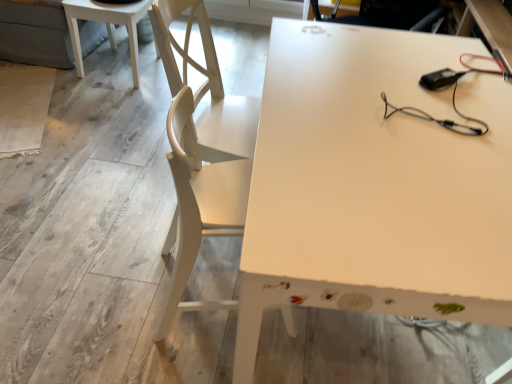
You are a GUI agent. You are given a task and a screenshot of the screen. Output one action in this format:
    pyautogui.click(x=<x>, y=<y>)
    Task: Click on the white wood chair at left
    
    Given the screenshot: What is the action you would take?
    pyautogui.click(x=199, y=204)

You are a GUI agent. You are given a task and a screenshot of the screen. Output one action in this format:
    pyautogui.click(x=<x>, y=<y>)
    Task: Click on the white glossy table at upper left, the first table in the top-to-bottom sequence
    This screenshot has height=384, width=512.
    Given the screenshot: What is the action you would take?
    pyautogui.click(x=106, y=26)

You are a GUI agent. You are given a task and a screenshot of the screen. Output one action in this format:
    pyautogui.click(x=<x>, y=<y>)
    Task: Click on the table above the white glossy table at upper left, acting as the first table starting from the back (from a real-world perspective)
    This screenshot has height=384, width=512.
    Given the screenshot: What is the action you would take?
    pyautogui.click(x=374, y=184)

Which is behind, point (94, 18) or point (377, 299)?

The point (94, 18) is farther.

From the image's perspective, is white glossy table at upper left, the 2th table in the right-to-left sequence, under white matte table at center, the 1th table positioned from the front?

No.

Is the surface of white matte table at center, the 1th table viewed from the right, in direct contact with white glossy table at upper left, the second table in the bottom-to-top sequence?

No, white matte table at center, the 1th table viewed from the right, is not making contact with white glossy table at upper left, the second table in the bottom-to-top sequence.

Is white glossy table at upper left, acting as the first table starting from the back, surrounded by white matte table at center, the 1th table viewed from the right?

No, white glossy table at upper left, acting as the first table starting from the back, is not inside white matte table at center, the 1th table viewed from the right.

Considering the points (504, 101) and (80, 76), which point is behind, point (504, 101) or point (80, 76)?

The point (80, 76) is behind.

Is white matte table at center, arranged as the 2th table when viewed from the top, looking in the opposite direction of white glossy table at upper left, placed as the second table when sorted from front to back?

That's not correct — white matte table at center, arranged as the 2th table when viewed from the top, is not looking away from white glossy table at upper left, placed as the second table when sorted from front to back.

Considering the relative sizes of white wood chair at left and white glossy table at upper left, the first table in the top-to-bottom sequence, in the image provided, is white wood chair at left shorter than white glossy table at upper left, the first table in the top-to-bottom sequence,?

No.

Considering the sizes of objects white wood chair at left and white glossy table at upper left, the first table in the top-to-bottom sequence, in the image provided, who is wider, white wood chair at left or white glossy table at upper left, the first table in the top-to-bottom sequence,?

white glossy table at upper left, the first table in the top-to-bottom sequence.

Does white wood chair at left contain white glossy table at upper left, the 2th table in the right-to-left sequence?

Actually, white glossy table at upper left, the 2th table in the right-to-left sequence, is outside white wood chair at left.

Would you say white wood chair at left is a long distance from white glossy table at upper left, the second table in the bottom-to-top sequence?

white wood chair at left is far away from white glossy table at upper left, the second table in the bottom-to-top sequence.

From the image's perspective, which one is positioned lower, white wood chair at left or white matte table at center, the 1th table viewed from the right?

white wood chair at left.

From a real-world perspective, is white wood chair at left physically above white matte table at center, the 1th table viewed from the right?

Yes.

Is white wood chair at left situated inside white matte table at center, the 1th table ordered from the bottom, or outside?

white wood chair at left is located inside white matte table at center, the 1th table ordered from the bottom.

How many degrees apart are the facing directions of white wood chair at left and white matte table at center, the 1th table positioned from the front?

172 degrees.

Considering the relative sizes of white glossy table at upper left, the first table in the top-to-bottom sequence, and white wood chair at left in the image provided, is white glossy table at upper left, the first table in the top-to-bottom sequence, thinner than white wood chair at left?

No.

Based on their positions, is white glossy table at upper left, placed as the second table when sorted from front to back, located to the left or right of white wood chair at left?

Clearly, white glossy table at upper left, placed as the second table when sorted from front to back, is on the left of white wood chair at left in the image.

Is white glossy table at upper left, acting as the first table starting from the back, positioned in front of white wood chair at left?

That is False.

Considering the relative sizes of white matte table at center, arranged as the 2th table when viewed from the top, and white wood chair at left in the image provided, is white matte table at center, arranged as the 2th table when viewed from the top, thinner than white wood chair at left?

No.

Consider the image. Considering the relative positions of white matte table at center, the 1th table ordered from the bottom, and white wood chair at left in the image provided, is white matte table at center, the 1th table ordered from the bottom, behind white wood chair at left?

No, it is in front of white wood chair at left.

Is white matte table at center, arranged as the 2th table when viewed from the top, inside the boundaries of white wood chair at left, or outside?

white matte table at center, arranged as the 2th table when viewed from the top, cannot be found inside white wood chair at left.

Between white matte table at center, the 1th table viewed from the right, and white wood chair at left, which one has smaller size?

→ Smaller between the two is white wood chair at left.

At what (x,y) coordinates should I click in order to perform the action: click on table below the white glossy table at upper left, the first table positioned from the left (from the image's perspective). Please return your answer as a coordinate pair (x, y). Looking at the image, I should click on (374, 184).

This screenshot has width=512, height=384. Find the location of `table that appears above the white glossy table at upper left, the 2th table in the right-to-left sequence (from a real-world perspective)`. table that appears above the white glossy table at upper left, the 2th table in the right-to-left sequence (from a real-world perspective) is located at coordinates (374, 184).

Consider the image. When comparing their distances from white wood chair at left, does white matte table at center, the 1th table viewed from the right, or white glossy table at upper left, the 2th table in the right-to-left sequence, seem further?

white glossy table at upper left, the 2th table in the right-to-left sequence, is positioned further to the anchor white wood chair at left.

Based on their spatial positions, is white wood chair at left or white glossy table at upper left, the 2th table in the right-to-left sequence, further from white matte table at center, which is the second table from back to front?

white glossy table at upper left, the 2th table in the right-to-left sequence.

Considering their positions, is white glossy table at upper left, acting as the first table starting from the back, positioned closer to white matte table at center, arranged as the 2th table when viewed from the top, than white wood chair at left?

Among the two, white wood chair at left is located nearer to white matte table at center, arranged as the 2th table when viewed from the top.

Based on their spatial positions, is white wood chair at left or white matte table at center, which is the second table from back to front, closer to white glossy table at upper left, the 2th table in the right-to-left sequence?

white wood chair at left is positioned closer to the anchor white glossy table at upper left, the 2th table in the right-to-left sequence.

From the image, which object appears to be farther from white glossy table at upper left, the first table in the top-to-bottom sequence, white matte table at center, arranged as the 2th table when viewed from the top, or white wood chair at left?

white matte table at center, arranged as the 2th table when viewed from the top, lies further to white glossy table at upper left, the first table in the top-to-bottom sequence, than the other object.

Which object lies nearer to the anchor point white wood chair at left, white glossy table at upper left, placed as the second table when sorted from front to back, or white matte table at center, arranged as the 2th table when viewed from the top?

Based on the image, white matte table at center, arranged as the 2th table when viewed from the top, appears to be nearer to white wood chair at left.

The width and height of the screenshot is (512, 384). What are the coordinates of `chair positioned between white matte table at center, which is the second table from back to front, and white glossy table at upper left, the second table in the bottom-to-top sequence, from near to far` in the screenshot? It's located at (199, 204).